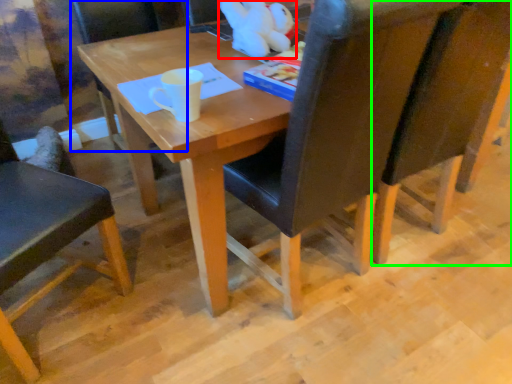
Question: Which object is the closest to the toy (highlighted by a red box)? Choose among these: chair (highlighted by a blue box) or chair (highlighted by a green box).

Choices:
 (A) chair
 (B) chair

Answer: (B)